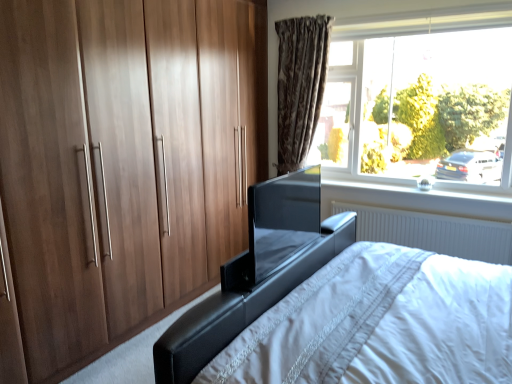
Locate an element on the screen. The width and height of the screenshot is (512, 384). empty space that is ontop of white plastic radiator at lower right (from a real-world perspective) is located at coordinates (448, 218).